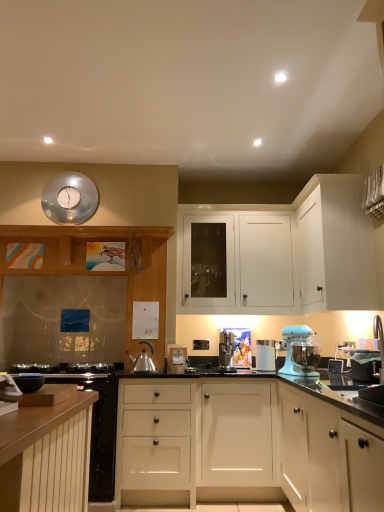
How much space does satin silver coffee machine at center, positioned as the 1th kitchen appliance in left-to-right order, occupy vertically?

satin silver coffee machine at center, positioned as the 1th kitchen appliance in left-to-right order, is 30.92 centimeters tall.

Locate an element on the screen. satin silver coffee machine at center, the second kitchen appliance when ordered from right to left is located at coordinates (226, 352).

Describe the element at coordinates (101, 272) in the screenshot. I see `wooden cabinet at left, the 2th cabinetry in the back-to-front sequence` at that location.

This screenshot has height=512, width=384. Find the location of `white matte cabinet at center, the 3th cabinetry when ordered from back to front`. white matte cabinet at center, the 3th cabinetry when ordered from back to front is located at coordinates (247, 442).

The height and width of the screenshot is (512, 384). Describe the element at coordinates (291, 343) in the screenshot. I see `light blue plastic stand mixer at center` at that location.

At what (x,y) coordinates should I click in order to perform the action: click on matte silver toaster at center, the second appliance from the left. Please return your answer as a coordinate pair (x, y). This screenshot has height=512, width=384. Looking at the image, I should click on (176, 358).

What do you see at coordinates (176, 358) in the screenshot?
I see `matte silver toaster at center, the second appliance from the left` at bounding box center [176, 358].

The width and height of the screenshot is (384, 512). I want to click on shiny metallic kettle at center, the 2th appliance when ordered from right to left, so click(x=142, y=362).

Is white matte cabinet at upper center, which is the 6th cabinetry from front to back, further to the viewer compared to wooden cabinet at left, the 5th cabinetry positioned from the front?

Yes, white matte cabinet at upper center, which is the 6th cabinetry from front to back, is further from the camera.

Which of these two, white matte cabinet at upper center, which is the 6th cabinetry from front to back, or wooden cabinet at left, the 2th cabinetry in the back-to-front sequence, is wider?

Wider between the two is white matte cabinet at upper center, which is the 6th cabinetry from front to back.

Consider the image. Considering the sizes of objects white matte cabinet at upper center, which is the 6th cabinetry from front to back, and wooden cabinet at left, the 5th cabinetry positioned from the front, in the image provided, who is shorter, white matte cabinet at upper center, which is the 6th cabinetry from front to back, or wooden cabinet at left, the 5th cabinetry positioned from the front,?

Standing shorter between the two is white matte cabinet at upper center, which is the 6th cabinetry from front to back.

From a real-world perspective, is white matte cabinet at upper center, the first cabinetry positioned from the back, located beneath wooden cabinet at left, the 2th cabinetry in the back-to-front sequence?

Actually, white matte cabinet at upper center, the first cabinetry positioned from the back, is physically above wooden cabinet at left, the 2th cabinetry in the back-to-front sequence, in the real world.

From the image's perspective, is white plastic container at center, which ranks as the 2th kitchen appliance in left-to-right order, beneath white matte cabinet at center, the 3th cabinetry when ordered from back to front?

No, from the image's perspective, white plastic container at center, which ranks as the 2th kitchen appliance in left-to-right order, is not beneath white matte cabinet at center, the 3th cabinetry when ordered from back to front.

How many degrees apart are the facing directions of white plastic container at center, which ranks as the 2th kitchen appliance in left-to-right order, and white matte cabinet at center, the fourth cabinetry positioned from the front?

white plastic container at center, which ranks as the 2th kitchen appliance in left-to-right order, and white matte cabinet at center, the fourth cabinetry positioned from the front, are facing 0.0337 degrees away from each other.

Where is `the 2nd cabinetry below the white plastic container at center, which ranks as the 2th kitchen appliance in left-to-right order (from a real-world perspective)`? The width and height of the screenshot is (384, 512). the 2nd cabinetry below the white plastic container at center, which ranks as the 2th kitchen appliance in left-to-right order (from a real-world perspective) is located at coordinates (247, 442).

Considering the relative sizes of white plastic container at center, acting as the first kitchen appliance starting from the right, and white matte cabinet at center, the 3th cabinetry when ordered from back to front, in the image provided, is white plastic container at center, acting as the first kitchen appliance starting from the right, taller than white matte cabinet at center, the 3th cabinetry when ordered from back to front,?

In fact, white plastic container at center, acting as the first kitchen appliance starting from the right, may be shorter than white matte cabinet at center, the 3th cabinetry when ordered from back to front.

From the picture: Is shiny metallic kettle at center, the 2th appliance when ordered from right to left, aimed at white matte cabinet at upper right, the second cabinetry in the front-to-back sequence?

No.

Considering the relative sizes of shiny metallic kettle at center, the 2th appliance when ordered from right to left, and white matte cabinet at upper right, the second cabinetry in the front-to-back sequence, in the image provided, is shiny metallic kettle at center, the 2th appliance when ordered from right to left, shorter than white matte cabinet at upper right, the second cabinetry in the front-to-back sequence,?

Correct, shiny metallic kettle at center, the 2th appliance when ordered from right to left, is not as tall as white matte cabinet at upper right, the second cabinetry in the front-to-back sequence.

Where is `cabinetry that is the 4th one when counting rightward from the shiny metallic kettle at center, the 2th appliance when ordered from right to left`? The image size is (384, 512). cabinetry that is the 4th one when counting rightward from the shiny metallic kettle at center, the 2th appliance when ordered from right to left is located at coordinates (334, 246).

How much distance is there between shiny metallic kettle at center, the 1th appliance from the left, and white matte cabinet at upper right, the second cabinetry in the front-to-back sequence?

A distance of 5.09 feet exists between shiny metallic kettle at center, the 1th appliance from the left, and white matte cabinet at upper right, the second cabinetry in the front-to-back sequence.

Considering the positions of objects wooden cabinet at left, the 5th cabinetry positioned from the front, and white matte cabinet at upper center, the first cabinetry positioned from the back, in the image provided, who is behind, wooden cabinet at left, the 5th cabinetry positioned from the front, or white matte cabinet at upper center, the first cabinetry positioned from the back,?

white matte cabinet at upper center, the first cabinetry positioned from the back, is more distant.

Is wooden cabinet at left, the 5th cabinetry positioned from the front, facing towards white matte cabinet at upper center, which is the 6th cabinetry from front to back?

No, wooden cabinet at left, the 5th cabinetry positioned from the front, is not turned towards white matte cabinet at upper center, which is the 6th cabinetry from front to back.

Considering the points (123, 233) and (268, 265), which point is in front, point (123, 233) or point (268, 265)?

The point (123, 233) is closer to the camera.

Does wooden cabinet at left, the 2th cabinetry in the back-to-front sequence, appear on the right side of white matte cabinet at upper center, which is the 6th cabinetry from front to back?

No.

Considering the positions of objects wooden cabinet at left, the 5th cabinetry positioned from the front, and shiny metallic kettle at center, the 2th appliance when ordered from right to left, in the image provided, who is more to the left, wooden cabinet at left, the 5th cabinetry positioned from the front, or shiny metallic kettle at center, the 2th appliance when ordered from right to left,?

From the viewer's perspective, wooden cabinet at left, the 5th cabinetry positioned from the front, appears more on the left side.

From the image's perspective, is wooden cabinet at left, the 2th cabinetry in the back-to-front sequence, on shiny metallic kettle at center, the 1th appliance from the left?

Yes, from the image's perspective, wooden cabinet at left, the 2th cabinetry in the back-to-front sequence, is on top of shiny metallic kettle at center, the 1th appliance from the left.

Based on the photo, is shiny metallic kettle at center, the 1th appliance from the left, at the back of wooden cabinet at left, the 5th cabinetry positioned from the front?

Yes, shiny metallic kettle at center, the 1th appliance from the left, is at the back of wooden cabinet at left, the 5th cabinetry positioned from the front.

Between wooden cabinet at left, the 5th cabinetry positioned from the front, and shiny metallic kettle at center, the 1th appliance from the left, which one has more height?

wooden cabinet at left, the 5th cabinetry positioned from the front, is taller.

Is light blue plastic stand mixer at center with white matte cabinet at upper center, the first cabinetry positioned from the back?

There is a gap between light blue plastic stand mixer at center and white matte cabinet at upper center, the first cabinetry positioned from the back.

In the image, is light blue plastic stand mixer at center on the left side or the right side of white matte cabinet at upper center, which is the 6th cabinetry from front to back?

light blue plastic stand mixer at center is to the right of white matte cabinet at upper center, which is the 6th cabinetry from front to back.

Does point (288, 328) appear closer or farther from the camera than point (253, 223)?

Point (288, 328) is positioned closer to the camera compared to point (253, 223).

From a real-world perspective, is light blue plastic stand mixer at center physically located above or below white matte cabinet at upper center, the first cabinetry positioned from the back?

light blue plastic stand mixer at center is below white matte cabinet at upper center, the first cabinetry positioned from the back.

Is point (202, 387) positioned behind point (351, 493)?

Yes, it is behind point (351, 493).

Is white matte cabinet at center, the 3th cabinetry when ordered from back to front, wider or thinner than matte white cabinet at lower right, acting as the 1th cabinetry starting from the front?

white matte cabinet at center, the 3th cabinetry when ordered from back to front, is wider than matte white cabinet at lower right, acting as the 1th cabinetry starting from the front.

Would you say matte white cabinet at lower right, acting as the 1th cabinetry starting from the front, is part of white matte cabinet at center, the fourth cabinetry positioned from the front,'s contents?

That's incorrect, matte white cabinet at lower right, acting as the 1th cabinetry starting from the front, is not inside white matte cabinet at center, the fourth cabinetry positioned from the front.

Where is `the 1st cabinetry below the white matte cabinet at upper center, the first cabinetry positioned from the back (from the image's perspective)`? The image size is (384, 512). the 1st cabinetry below the white matte cabinet at upper center, the first cabinetry positioned from the back (from the image's perspective) is located at coordinates (101, 272).

You are a GUI agent. You are given a task and a screenshot of the screen. Output one action in this format:
    pyautogui.click(x=<x>, y=<y>)
    Task: Click on the cabinetry that is the 2nd object located in front of the white plastic container at center, acting as the first kitchen appliance starting from the right
    
    Given the screenshot: What is the action you would take?
    pyautogui.click(x=247, y=442)

Based on their spatial positions, is white plastic container at center, which ranks as the 2th kitchen appliance in left-to-right order, or matte silver toaster at center, which is the first appliance in right-to-left order, closer to white matte cabinet at lower left, acting as the third cabinetry starting from the front?

matte silver toaster at center, which is the first appliance in right-to-left order, is closer to white matte cabinet at lower left, acting as the third cabinetry starting from the front.

Based on their spatial positions, is light blue plastic stand mixer at center or metallic reflective clock at upper center closer to white matte cabinet at center, the fourth cabinetry positioned from the front?

light blue plastic stand mixer at center.

Which object lies nearer to the anchor point white matte cabinet at upper center, the first cabinetry positioned from the back, wooden cabinet at left, the 5th cabinetry positioned from the front, or metallic reflective clock at upper center?

Based on the image, wooden cabinet at left, the 5th cabinetry positioned from the front, appears to be nearer to white matte cabinet at upper center, the first cabinetry positioned from the back.

Consider the image. Estimate the real-world distances between objects in this image. Which object is further from light blue plastic stand mixer at center, white matte cabinet at upper right, the fifth cabinetry in the back-to-front sequence, or matte white cabinet at lower right, which ranks as the 6th cabinetry in back-to-front order?

matte white cabinet at lower right, which ranks as the 6th cabinetry in back-to-front order, is positioned further to the anchor light blue plastic stand mixer at center.

From the image, which object appears to be farther from white matte cabinet at upper center, which is the 6th cabinetry from front to back, matte silver toaster at center, the second appliance from the left, or wooden cabinet at left, the 5th cabinetry positioned from the front?

matte silver toaster at center, the second appliance from the left.

Considering their positions, is shiny metallic kettle at center, the 2th appliance when ordered from right to left, positioned further to matte white cabinet at lower right, which ranks as the 6th cabinetry in back-to-front order, than white matte cabinet at lower left, which is the fourth cabinetry in back-to-front order?

Among the two, shiny metallic kettle at center, the 2th appliance when ordered from right to left, is located further to matte white cabinet at lower right, which ranks as the 6th cabinetry in back-to-front order.

From the image, which object appears to be farther from white matte cabinet at center, the 3th cabinetry when ordered from back to front, metallic reflective clock at upper center or white matte cabinet at upper right, the fifth cabinetry in the back-to-front sequence?

Among the two, metallic reflective clock at upper center is located further to white matte cabinet at center, the 3th cabinetry when ordered from back to front.

Estimate the real-world distances between objects in this image. Which object is closer to shiny metallic kettle at center, the 1th appliance from the left, matte white cabinet at lower right, which ranks as the 6th cabinetry in back-to-front order, or white matte cabinet at lower left, which is the fourth cabinetry in back-to-front order?

matte white cabinet at lower right, which ranks as the 6th cabinetry in back-to-front order, is positioned closer to the anchor shiny metallic kettle at center, the 1th appliance from the left.

Find the location of `appliance between shiny metallic kettle at center, the 2th appliance when ordered from right to left, and light blue plastic stand mixer at center`. appliance between shiny metallic kettle at center, the 2th appliance when ordered from right to left, and light blue plastic stand mixer at center is located at coordinates (176, 358).

Find the location of `home appliance between matte white cabinet at lower right, acting as the 1th cabinetry starting from the front, and white plastic container at center, acting as the first kitchen appliance starting from the right, from front to back`. home appliance between matte white cabinet at lower right, acting as the 1th cabinetry starting from the front, and white plastic container at center, acting as the first kitchen appliance starting from the right, from front to back is located at coordinates (291, 343).

Locate an element on the screen. The image size is (384, 512). kitchen appliance that lies between metallic reflective clock at upper center and shiny metallic kettle at center, the 1th appliance from the left, from top to bottom is located at coordinates (226, 352).

Where is `home appliance between white matte cabinet at upper center, the first cabinetry positioned from the back, and white matte cabinet at center, the fourth cabinetry positioned from the front, vertically`? home appliance between white matte cabinet at upper center, the first cabinetry positioned from the back, and white matte cabinet at center, the fourth cabinetry positioned from the front, vertically is located at coordinates (291, 343).